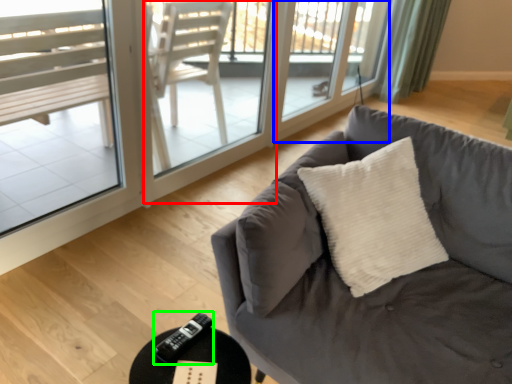
Question: Which object is positioned closest to screen door (highlighted by a red box)? Select from screen door (highlighted by a blue box) and remote (highlighted by a green box).

Choices:
 (A) screen door
 (B) remote

Answer: (A)